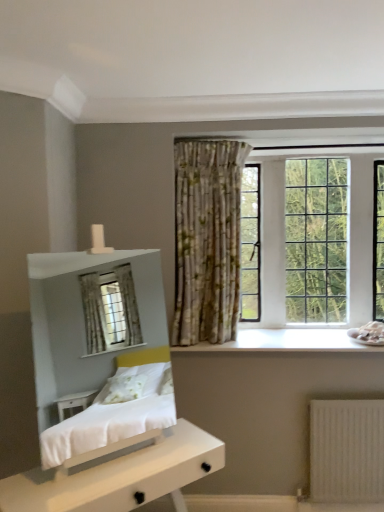
Question: Could white matte nightstand at lower left be considered to be inside white wood at center?

Choices:
 (A) yes
 (B) no

Answer: (B)

Question: Does white wood at center appear on the right side of white matte nightstand at lower left?

Choices:
 (A) yes
 (B) no

Answer: (A)

Question: Is white wood at center aimed at white matte nightstand at lower left?

Choices:
 (A) no
 (B) yes

Answer: (A)

Question: Can you confirm if white wood at center is shorter than white matte nightstand at lower left?

Choices:
 (A) no
 (B) yes

Answer: (B)

Question: From a real-world perspective, is white wood at center on top of white matte nightstand at lower left?

Choices:
 (A) no
 (B) yes

Answer: (B)

Question: Is white wood at center not within white matte nightstand at lower left?

Choices:
 (A) no
 (B) yes

Answer: (B)

Question: Would you say white matte nightstand at lower left contains white wood at center?

Choices:
 (A) no
 (B) yes

Answer: (A)

Question: From a real-world perspective, is white matte nightstand at lower left on top of white wood at center?

Choices:
 (A) no
 (B) yes

Answer: (A)

Question: From the image's perspective, is white matte nightstand at lower left located beneath white wood at center?

Choices:
 (A) yes
 (B) no

Answer: (A)

Question: Can you confirm if white matte nightstand at lower left is positioned to the right of white wood at center?

Choices:
 (A) yes
 (B) no

Answer: (B)

Question: Is white matte nightstand at lower left not near white wood at center?

Choices:
 (A) yes
 (B) no

Answer: (B)

Question: Could you tell me if white matte nightstand at lower left is turned towards white wood at center?

Choices:
 (A) yes
 (B) no

Answer: (B)

Question: Is clear glass window at upper right located within white matte nightstand at lower left?

Choices:
 (A) no
 (B) yes

Answer: (A)